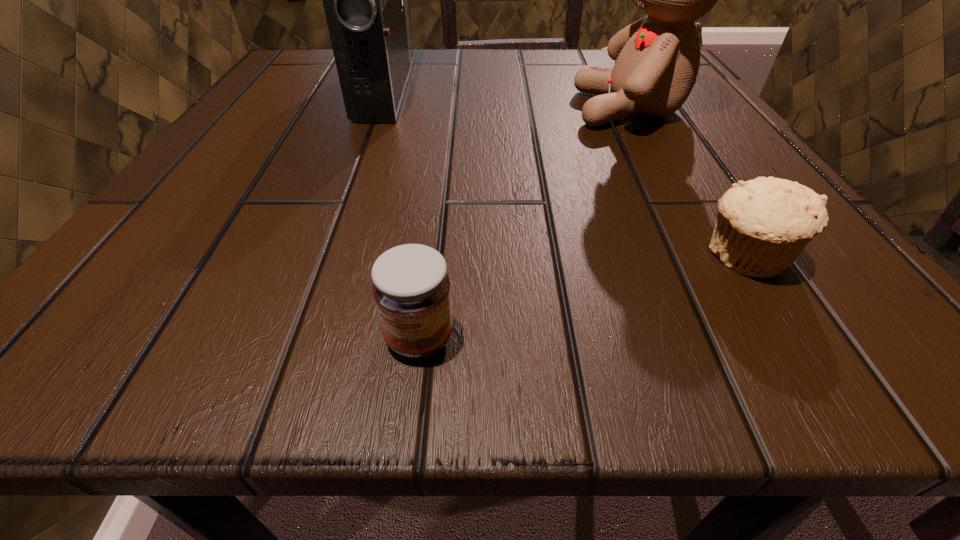
Image resolution: width=960 pixels, height=540 pixels. In order to click on the leftmost object in this screenshot , I will do `click(366, 0)`.

Locate an element on the screen. rag_doll is located at coordinates (657, 58).

Identify the location of the second nearest object. (762, 226).

This screenshot has width=960, height=540. Find the location of `the second object from left to right`. the second object from left to right is located at coordinates (411, 287).

The width and height of the screenshot is (960, 540). What are the coordinates of `the nearest object` in the screenshot? It's located at (411, 287).

Identify the location of blank space located 0.370m on the front-facing side of the radio receiver. The width and height of the screenshot is (960, 540). [x=624, y=88].

Image resolution: width=960 pixels, height=540 pixels. I want to click on vacant space positioned on the front-facing side of the rag_doll, so click(x=537, y=109).

This screenshot has width=960, height=540. I want to click on vacant space located on the front-facing side of the rag_doll, so click(x=531, y=109).

Find the location of a particular element. The image size is (960, 540). vacant region located 0.170m on the front-facing side of the rag_doll is located at coordinates (468, 109).

The width and height of the screenshot is (960, 540). I want to click on vacant space located 0.270m on the back of the third farthest object, so click(x=658, y=118).